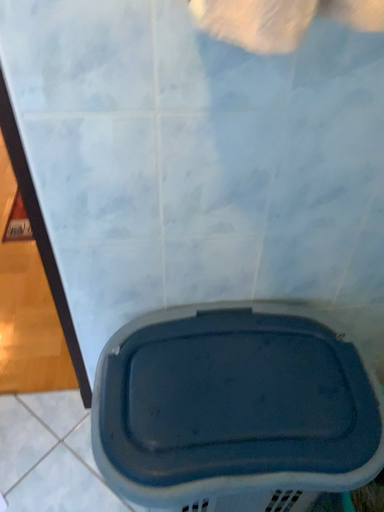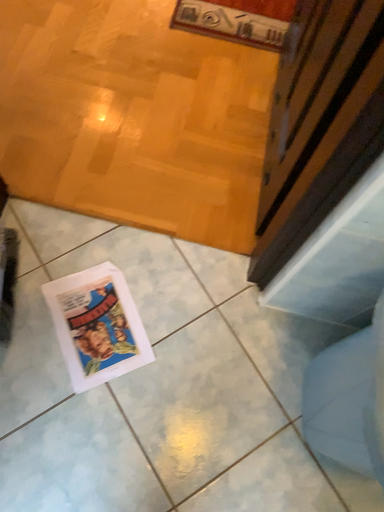
Question: Which way did the camera rotate in the video?

Choices:
 (A) rotated upward
 (B) rotated downward

Answer: (B)